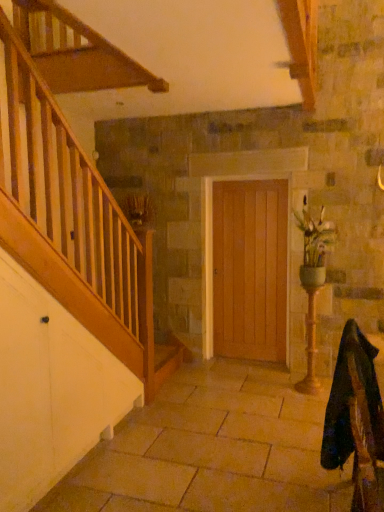
Question: Considering the relative sizes of green ceramic vase at right and velvet dark green rocking chair at lower right in the image provided, is green ceramic vase at right thinner than velvet dark green rocking chair at lower right?

Choices:
 (A) yes
 (B) no

Answer: (A)

Question: Is the depth of green ceramic vase at right greater than that of velvet dark green rocking chair at lower right?

Choices:
 (A) no
 (B) yes

Answer: (B)

Question: Is green ceramic vase at right looking in the opposite direction of velvet dark green rocking chair at lower right?

Choices:
 (A) yes
 (B) no

Answer: (B)

Question: Considering the relative sizes of green ceramic vase at right and velvet dark green rocking chair at lower right in the image provided, is green ceramic vase at right wider than velvet dark green rocking chair at lower right?

Choices:
 (A) no
 (B) yes

Answer: (A)

Question: Is green ceramic vase at right closer to camera compared to velvet dark green rocking chair at lower right?

Choices:
 (A) yes
 (B) no

Answer: (B)

Question: From a real-world perspective, is green ceramic vase at right physically below velvet dark green rocking chair at lower right?

Choices:
 (A) yes
 (B) no

Answer: (B)

Question: Is velvet dark green rocking chair at lower right further to camera compared to brown textured plant at upper left?

Choices:
 (A) yes
 (B) no

Answer: (B)

Question: From a real-world perspective, is velvet dark green rocking chair at lower right below brown textured plant at upper left?

Choices:
 (A) yes
 (B) no

Answer: (A)

Question: From the image's perspective, does velvet dark green rocking chair at lower right appear higher than brown textured plant at upper left?

Choices:
 (A) yes
 (B) no

Answer: (B)

Question: From the image's perspective, is velvet dark green rocking chair at lower right under brown textured plant at upper left?

Choices:
 (A) yes
 (B) no

Answer: (A)

Question: Is velvet dark green rocking chair at lower right positioned in front of brown textured plant at upper left?

Choices:
 (A) yes
 (B) no

Answer: (A)

Question: Is velvet dark green rocking chair at lower right not inside brown textured plant at upper left?

Choices:
 (A) yes
 (B) no

Answer: (A)

Question: Does brown textured plant at upper left come behind wooden door at center?

Choices:
 (A) no
 (B) yes

Answer: (B)